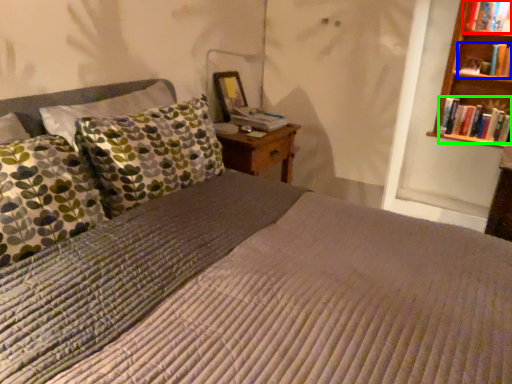
Question: Estimate the real-world distances between objects in this image. Which object is closer to book (highlighted by a red box), book (highlighted by a blue box) or book (highlighted by a green box)?

Choices:
 (A) book
 (B) book

Answer: (A)